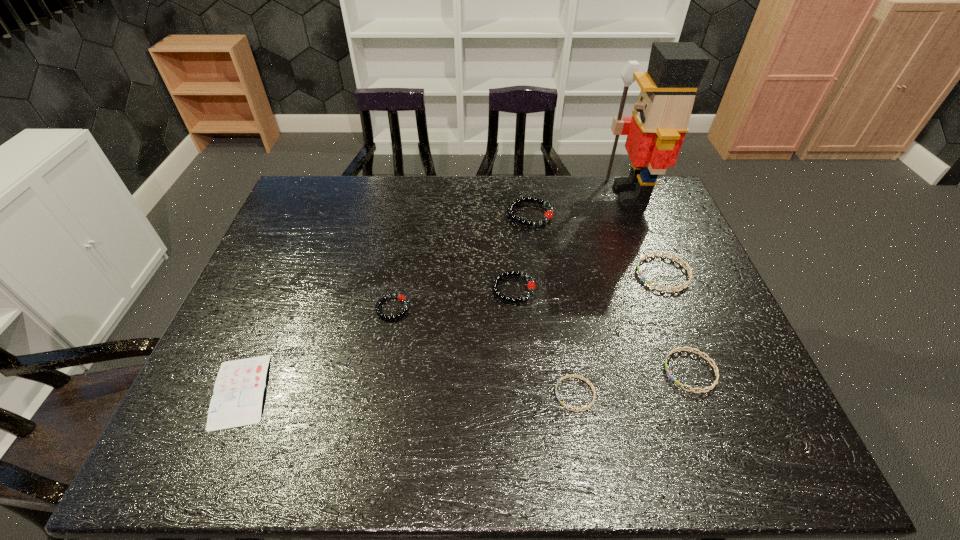
Identify the location of free spot at the far left corner of the desktop. Image resolution: width=960 pixels, height=540 pixels. (338, 200).

At what (x,y) coordinates should I click in order to perform the action: click on vacant position at the far right corner of the desktop. Please return your answer as a coordinate pair (x, y). Image resolution: width=960 pixels, height=540 pixels. Looking at the image, I should click on (664, 192).

Identify the location of vacant area between the second biggest black bracelet and the seventh tallest object. Image resolution: width=960 pixels, height=540 pixels. (544, 341).

In order to click on free space that is in between the tallest object and the leftmost black bracelet in this screenshot , I will do `click(512, 251)`.

At what (x,y) coordinates should I click in order to perform the action: click on blank region between the seventh shortest object and the diary. Please return your answer as a coordinate pair (x, y). The image size is (960, 540). Looking at the image, I should click on (386, 303).

This screenshot has width=960, height=540. Find the location of `unoccupied position between the biggest blue bracelet and the red nutcracker`. unoccupied position between the biggest blue bracelet and the red nutcracker is located at coordinates (647, 234).

You are a GUI agent. You are given a task and a screenshot of the screen. Output one action in this format:
    pyautogui.click(x=<x>, y=<y>)
    Task: Click on the unoccupied area between the second biggest blue bracelet and the leftmost bracelet
    The width and height of the screenshot is (960, 540).
    Given the screenshot: What is the action you would take?
    pyautogui.click(x=541, y=340)

In order to click on free space between the shortest object and the nutcracker in this screenshot , I will do `click(436, 293)`.

Find the location of `free space between the leftmost bracelet and the second biggest blue bracelet`. free space between the leftmost bracelet and the second biggest blue bracelet is located at coordinates (541, 340).

Where is `free area in between the farthest black bracelet and the shortest object`? This screenshot has height=540, width=960. free area in between the farthest black bracelet and the shortest object is located at coordinates (386, 303).